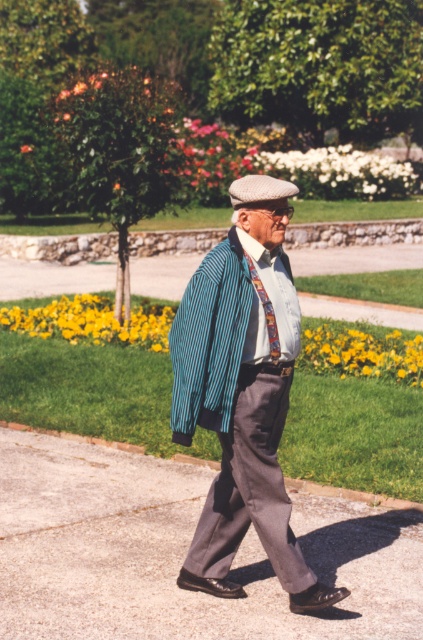
From the picture: You are a drone operator trying to capture the elderly man walking in the park. You need to fly your drone from point A to point B. Given that point A is at point (x=291, y=632) and point B is at point (x=219, y=378), which point is closer to the elderly man?

Point B at (x=219, y=378) is closer to the elderly man because point A at (x=291, y=632) is behind it, meaning the elderly man is nearer to point B.